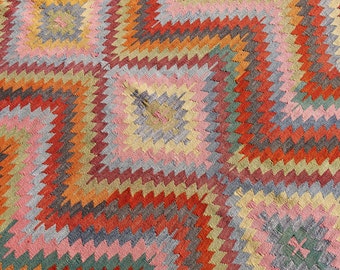
Image resolution: width=340 pixels, height=270 pixels. Find the location of `beige threads or yarn used to make rug or blanket`. beige threads or yarn used to make rug or blanket is located at coordinates [243, 162], [191, 189].